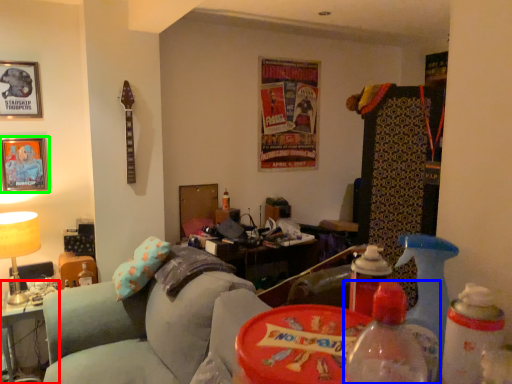
Question: Which is farther away from table (highlighted by a red box)? bottle (highlighted by a blue box) or picture frame (highlighted by a green box)?

Choices:
 (A) bottle
 (B) picture frame

Answer: (A)